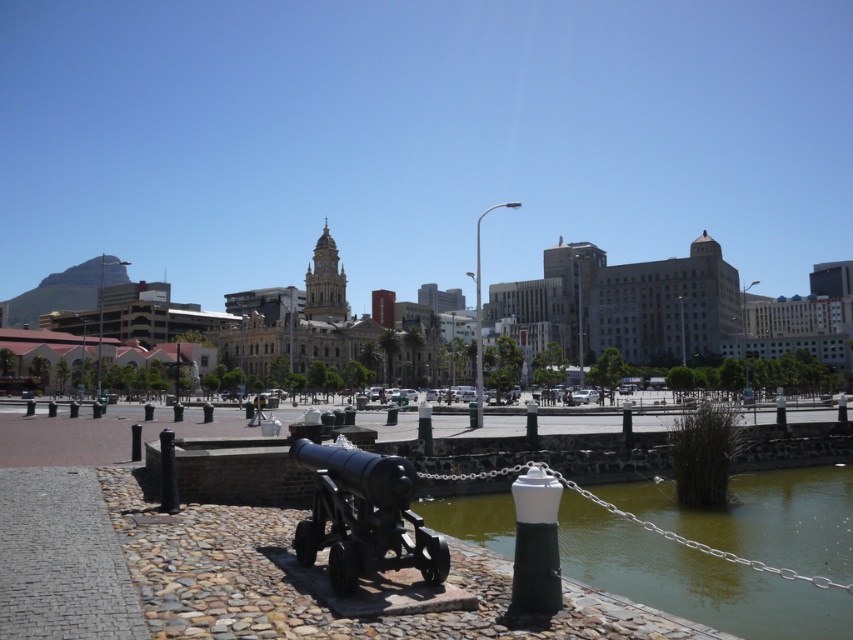
Question: From the image, what is the correct spatial relationship of green stone river at lower center in relation to polished bronze cannon at center?

Choices:
 (A) right
 (B) left

Answer: (A)

Question: Considering the real-world distances, which object is closest to the metallic pole at center?

Choices:
 (A) polished bronze cannon at center
 (B) green stone river at lower center

Answer: (B)

Question: Which point is farther from the camera taking this photo?

Choices:
 (A) (399, 458)
 (B) (786, 484)
 (C) (479, 273)

Answer: (C)

Question: Does green stone river at lower center lie in front of polished bronze cannon at center?

Choices:
 (A) yes
 (B) no

Answer: (B)

Question: Which object is farther from the camera taking this photo?

Choices:
 (A) polished bronze cannon at center
 (B) green stone river at lower center
 (C) metallic pole at center

Answer: (C)

Question: Can you confirm if polished bronze cannon at center is smaller than metallic pole at center?

Choices:
 (A) yes
 (B) no

Answer: (A)